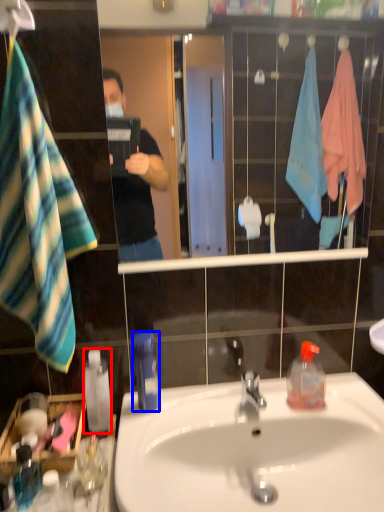
Question: Which object is closer to the camera taking this photo, bottle (highlighted by a red box) or bottle (highlighted by a blue box)?

Choices:
 (A) bottle
 (B) bottle

Answer: (B)